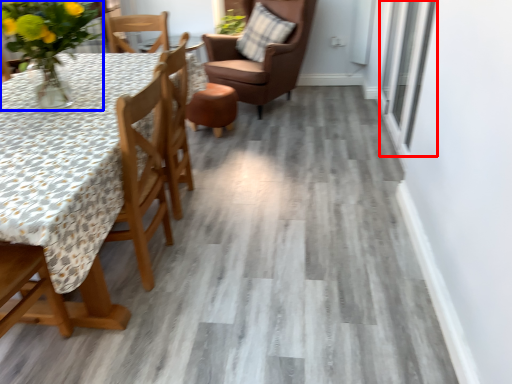
Question: Which object appears closest to the camera in this image, window (highlighted by a red box) or floral arrangement (highlighted by a blue box)?

Choices:
 (A) window
 (B) floral arrangement

Answer: (B)